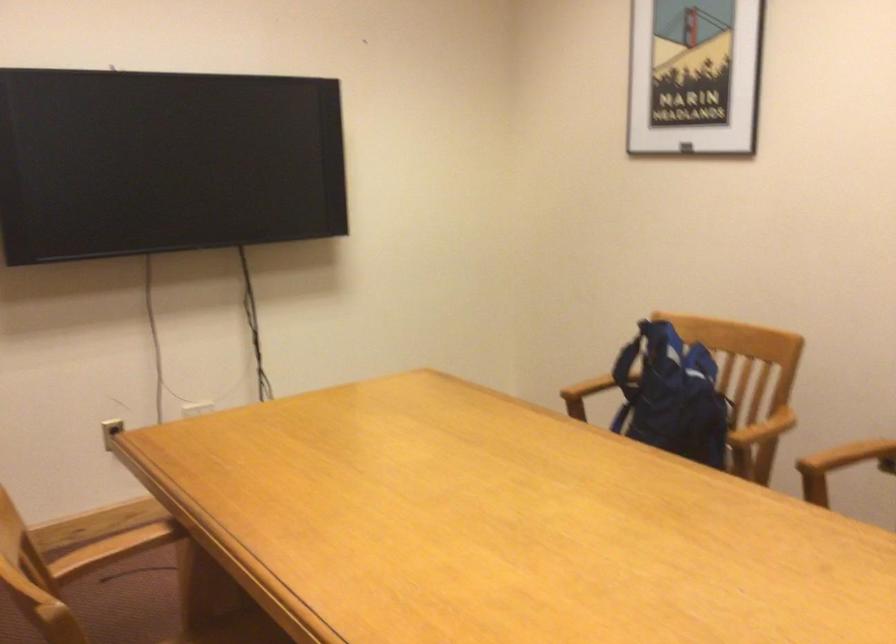
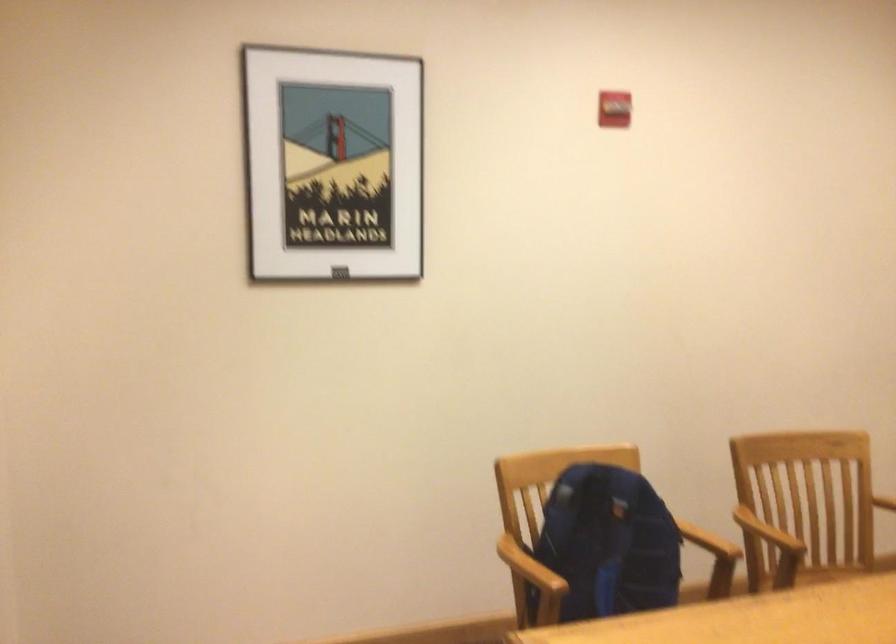
Find the pixel in the second image that matches pixel 825 453 in the first image.

(767, 532)